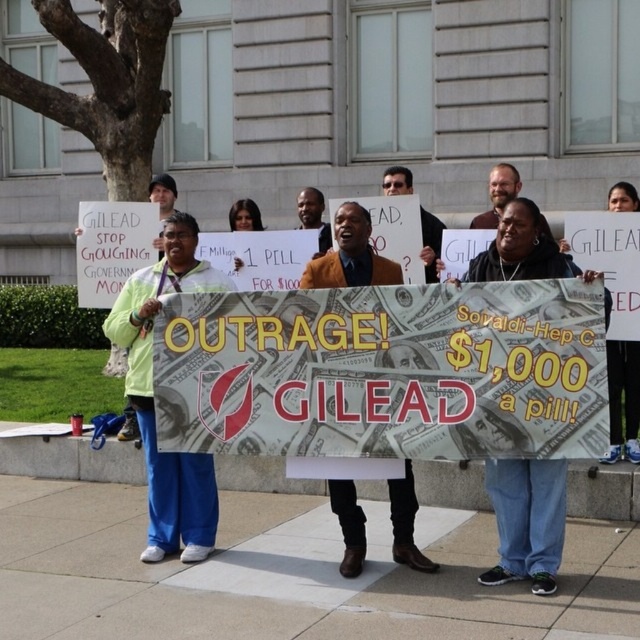
Question: Which point is farther to the camera?

Choices:
 (A) (129, 305)
 (B) (392, 188)
 (C) (301, 195)

Answer: (C)

Question: Estimate the real-world distances between objects in this image. Which object is closer to the bearded man at center?

Choices:
 (A) light green fabric pants at center
 (B) smooth brown skin at center
 (C) matte brown shirt at center

Answer: (C)

Question: Is matte brown shirt at center further to camera compared to bearded man at center?

Choices:
 (A) yes
 (B) no

Answer: (A)

Question: Does bearded man at center appear on the left side of smooth brown skin at center?

Choices:
 (A) yes
 (B) no

Answer: (B)

Question: Where is bearded man at center located in relation to smooth brown skin at center in the image?

Choices:
 (A) right
 (B) left

Answer: (A)

Question: Which of these objects is positioned closest to the matte brown shirt at center?

Choices:
 (A) light green fabric pants at center
 (B) bearded man at center
 (C) smooth brown skin at center

Answer: (B)